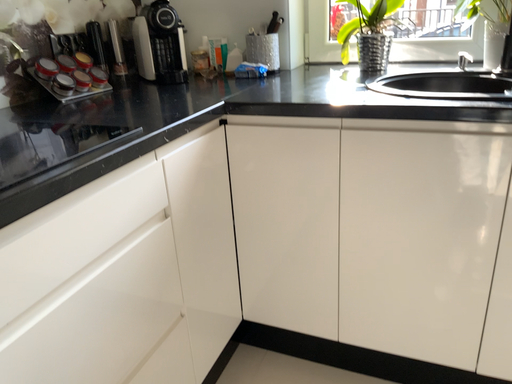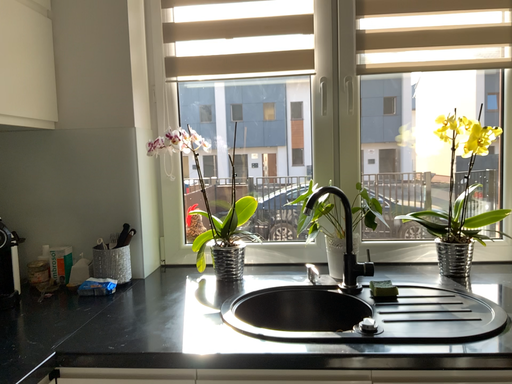
Question: How did the camera likely rotate when shooting the video?

Choices:
 (A) rotated upward
 (B) rotated downward

Answer: (A)